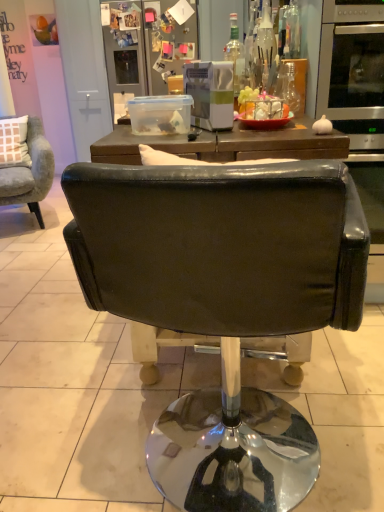
Question: Can you confirm if black leather chair at center, positioned as the 1th chair in bottom-to-top order, is wider than metallic silver refrigerator at upper center?

Choices:
 (A) no
 (B) yes

Answer: (B)

Question: From a real-world perspective, is black leather chair at center, which is counted as the 1th chair, starting from the front, under metallic silver refrigerator at upper center?

Choices:
 (A) yes
 (B) no

Answer: (A)

Question: Is black leather chair at center, the second chair positioned from the top, thinner than metallic silver refrigerator at upper center?

Choices:
 (A) no
 (B) yes

Answer: (A)

Question: Is black leather chair at center, positioned as the 1th chair in bottom-to-top order, facing towards metallic silver refrigerator at upper center?

Choices:
 (A) yes
 (B) no

Answer: (A)

Question: Is black leather chair at center, which is counted as the 1th chair, starting from the front, to the right of metallic silver refrigerator at upper center from the viewer's perspective?

Choices:
 (A) yes
 (B) no

Answer: (A)

Question: From the image's perspective, is black leather chair at center, placed as the second chair when sorted from back to front, above metallic silver refrigerator at upper center?

Choices:
 (A) yes
 (B) no

Answer: (B)

Question: Could you tell me if clear glass bottle at upper center, which ranks as the 1th bottle in left-to-right order, is turned towards metallic silver refrigerator at upper center?

Choices:
 (A) no
 (B) yes

Answer: (A)

Question: From a real-world perspective, is clear glass bottle at upper center, which is the 4th bottle in right-to-left order, over metallic silver refrigerator at upper center?

Choices:
 (A) yes
 (B) no

Answer: (B)

Question: Is clear glass bottle at upper center, which ranks as the 1th bottle in left-to-right order, thinner than metallic silver refrigerator at upper center?

Choices:
 (A) yes
 (B) no

Answer: (A)

Question: From the image's perspective, is clear glass bottle at upper center, which ranks as the 1th bottle in left-to-right order, located above metallic silver refrigerator at upper center?

Choices:
 (A) no
 (B) yes

Answer: (A)

Question: Considering the relative sizes of clear glass bottle at upper center, which ranks as the 1th bottle in left-to-right order, and metallic silver refrigerator at upper center in the image provided, is clear glass bottle at upper center, which ranks as the 1th bottle in left-to-right order, wider than metallic silver refrigerator at upper center?

Choices:
 (A) yes
 (B) no

Answer: (B)

Question: Considering the relative sizes of clear glass bottle at upper center, which ranks as the 1th bottle in left-to-right order, and metallic silver refrigerator at upper center in the image provided, is clear glass bottle at upper center, which ranks as the 1th bottle in left-to-right order, shorter than metallic silver refrigerator at upper center?

Choices:
 (A) no
 (B) yes

Answer: (B)

Question: Is transparent glass bottle at upper center, the second bottle when ordered from left to right, smaller than transparent glass bottle at upper right, which is counted as the second bottle, starting from the right?

Choices:
 (A) yes
 (B) no

Answer: (A)